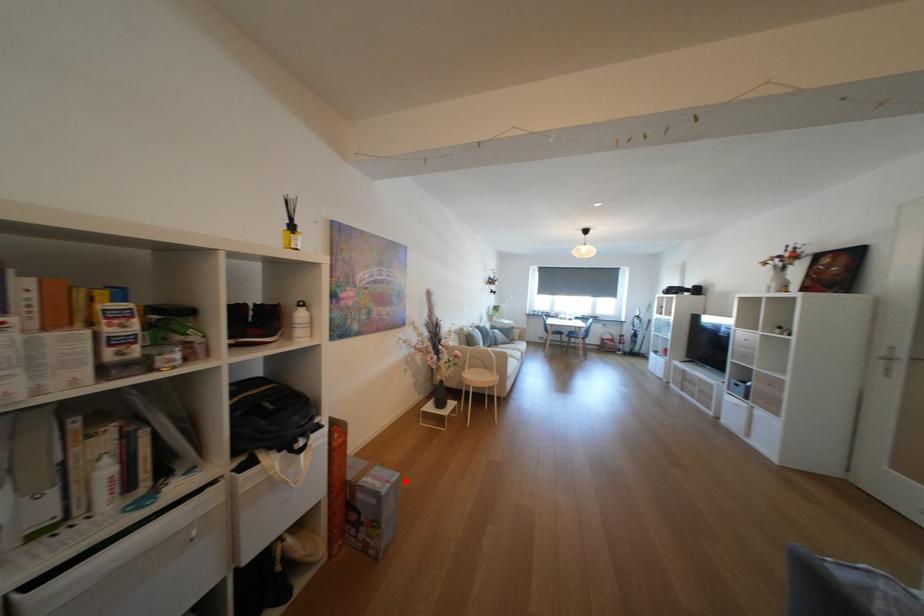
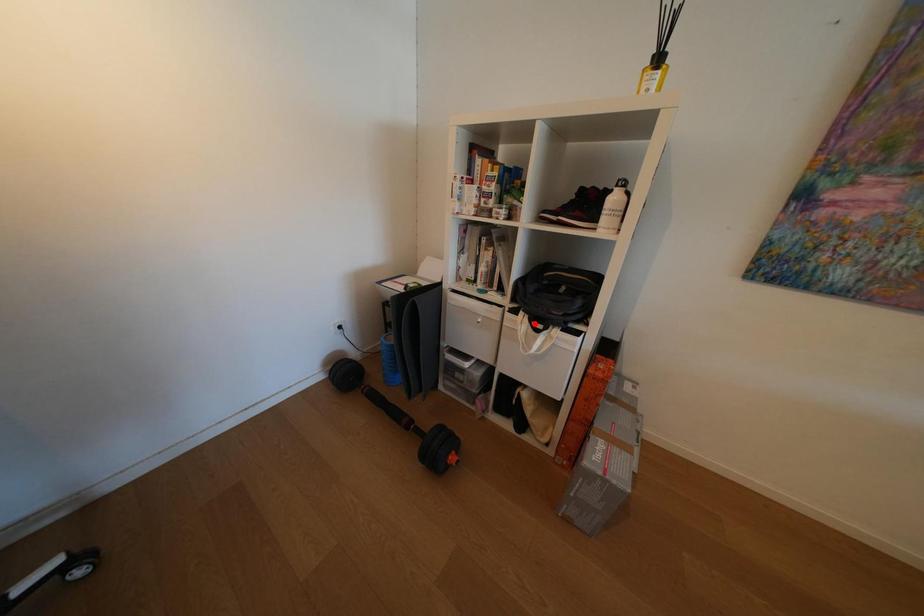
I am providing you with two images of the same scene from different viewpoints. A red point is marked on the first image and another point is marked on the second image. Are the points marked in image1 and image2 representing the same 3D position?

No